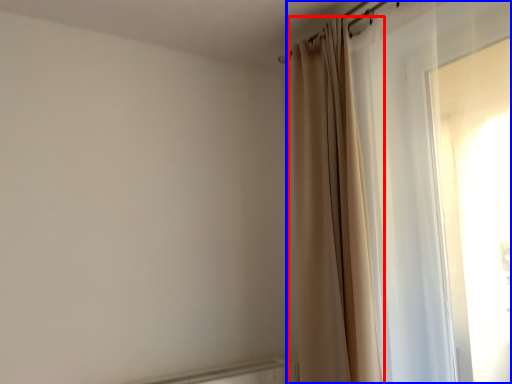
Question: Which object is further to the camera taking this photo, curtain (highlighted by a red box) or curtain (highlighted by a blue box)?

Choices:
 (A) curtain
 (B) curtain

Answer: (A)